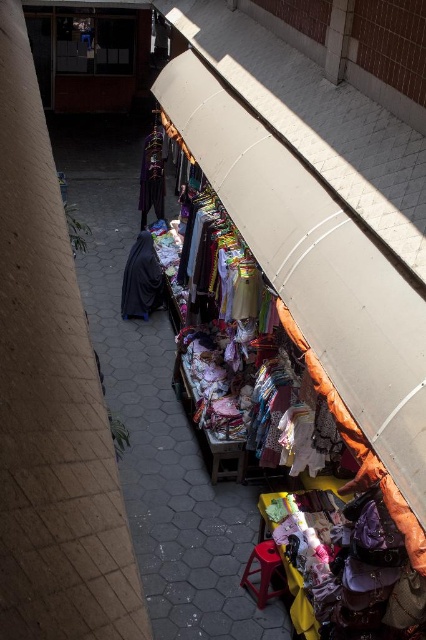
Question: Is the position of black matte fabric at center more distant than that of velvet purple dress at center?

Choices:
 (A) yes
 (B) no

Answer: (B)

Question: In this image, where is black matte fabric at center located relative to velvet purple dress at center?

Choices:
 (A) above
 (B) below

Answer: (B)

Question: Which point is closer to the camera?

Choices:
 (A) (137, 244)
 (B) (143, 172)

Answer: (A)

Question: Observing the image, what is the correct spatial positioning of black matte fabric at center in reference to velvet purple dress at center?

Choices:
 (A) above
 (B) below

Answer: (B)

Question: Which point is farther to the camera?

Choices:
 (A) (138, 250)
 (B) (158, 193)

Answer: (B)